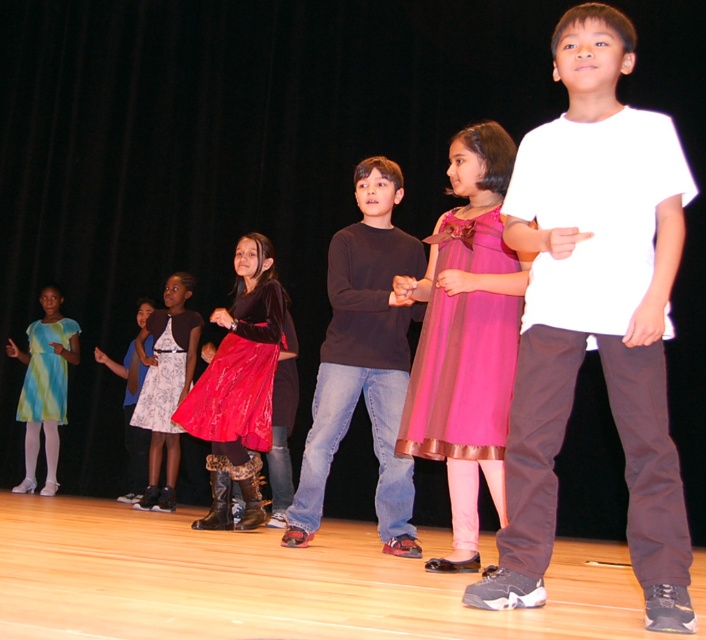
What do you see at coordinates (462, 349) in the screenshot? I see `pink satin dress at center` at bounding box center [462, 349].

Who is more distant from viewer, (436,355) or (59,337)?

The point (59,337) is more distant.

Does point (436, 358) come farther from viewer compared to point (11, 349)?

No, it is not.

The width and height of the screenshot is (706, 640). What are the coordinates of `pink satin dress at center` in the screenshot? It's located at (462, 349).

Is dark gray sweater at center above white satin dress at center?

Correct, dark gray sweater at center is located above white satin dress at center.

How distant is dark gray sweater at center from white satin dress at center?

dark gray sweater at center is 2.70 meters from white satin dress at center.

Who is more distant from viewer, (419, 269) or (149, 321)?

Positioned behind is point (149, 321).

Locate an element on the screen. The image size is (706, 640). dark gray sweater at center is located at coordinates (364, 360).

Is point (13, 342) more distant than point (160, 344)?

That is True.

Between matte green dress at left and white satin dress at center, which one is positioned higher?

white satin dress at center is higher up.

At what (x,y) coordinates should I click in order to perform the action: click on matte green dress at left. Please return your answer as a coordinate pair (x, y). Looking at the image, I should click on (44, 387).